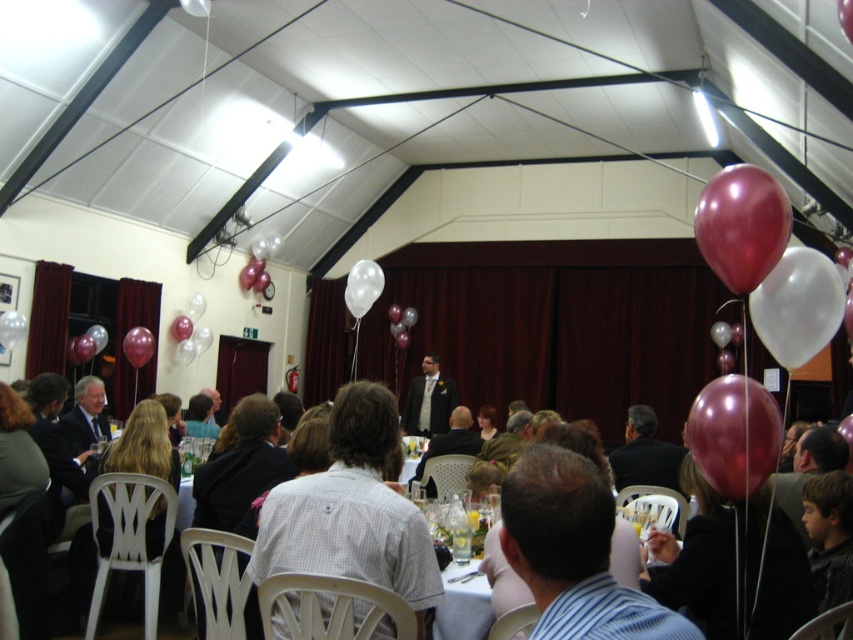
Question: Is metallic red balloon at right smaller than white glossy balloon at upper left?

Choices:
 (A) no
 (B) yes

Answer: (A)

Question: Is white textured shirt at center smaller than metallic red balloon at upper right?

Choices:
 (A) no
 (B) yes

Answer: (A)

Question: Considering the real-world distances, which object is farthest from the matte black suit at center?

Choices:
 (A) white glossy balloon at center
 (B) metallic pink balloon at left
 (C) metallic red balloon at right
 (D) transparent white balloon at center

Answer: (C)

Question: Which point appears closest to the camera in this image?

Choices:
 (A) (148, 355)
 (B) (440, 416)

Answer: (A)

Question: Can you confirm if striped cotton shirt at center is smaller than metallic red balloon at right?

Choices:
 (A) yes
 (B) no

Answer: (B)

Question: Which point is closer to the camera?

Choices:
 (A) metallic pink balloon at left
 (B) pink metallic balloon at center
 (C) white textured shirt at center

Answer: (C)